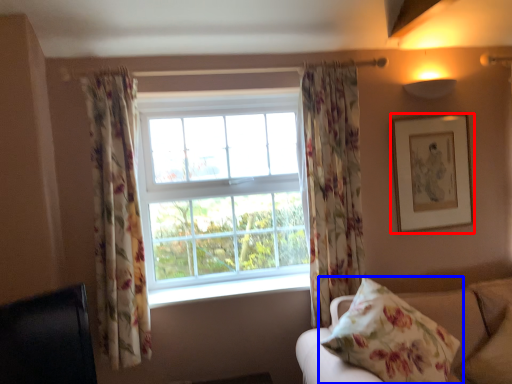
Question: Which object is further to the camera taking this photo, picture frame (highlighted by a red box) or pillow (highlighted by a blue box)?

Choices:
 (A) picture frame
 (B) pillow

Answer: (A)